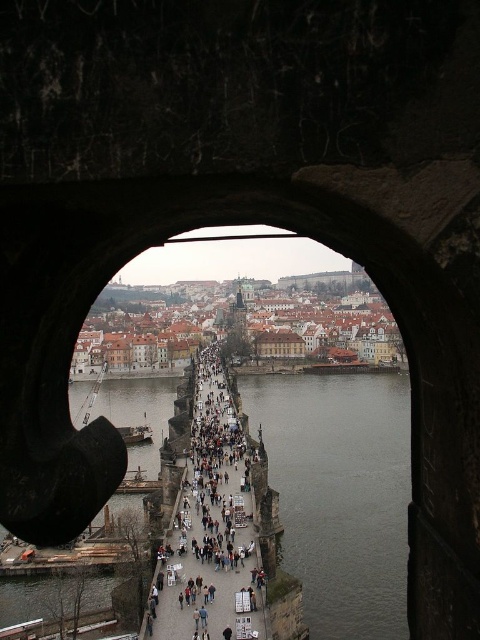
Who is shorter, dark gray water at center or light brown wooden bridge at center?

Standing shorter between the two is light brown wooden bridge at center.

Which is above, dark gray water at center or light brown wooden bridge at center?

light brown wooden bridge at center is higher up.

Who is more distant from viewer, (396, 376) or (193, 577)?

The point (396, 376) is behind.

Image resolution: width=480 pixels, height=640 pixels. Find the location of `dark gray water at center`. dark gray water at center is located at coordinates (339, 493).